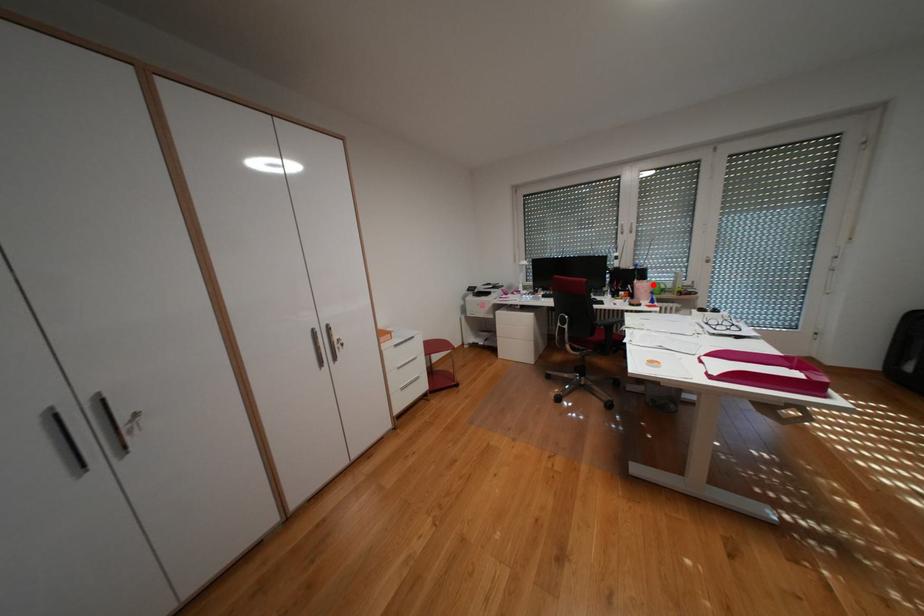
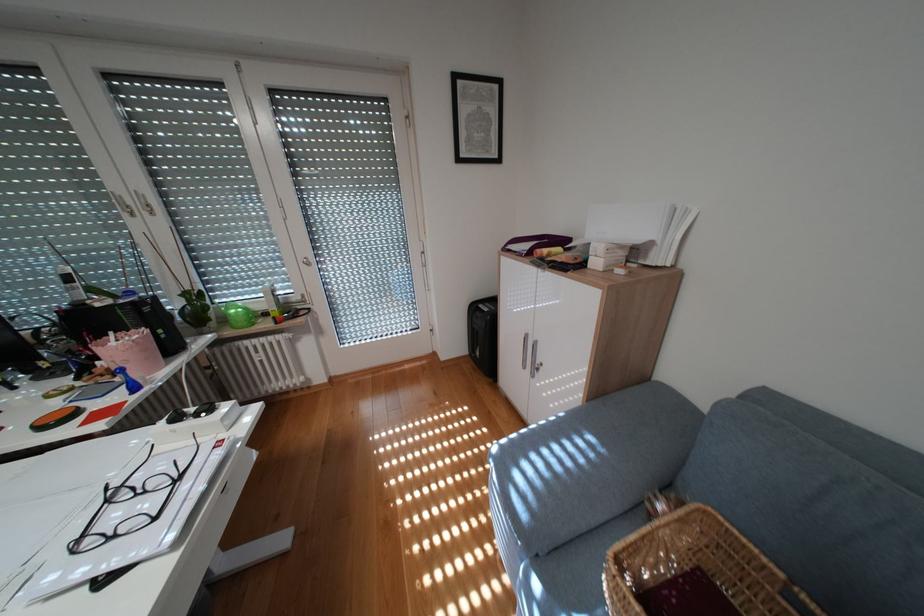
Question: I am providing you with two images of the same scene from different viewpoints. A red point is marked on the first image. Is the red point's position out of view in image 2?

Choices:
 (A) Yes
 (B) No

Answer: (B)